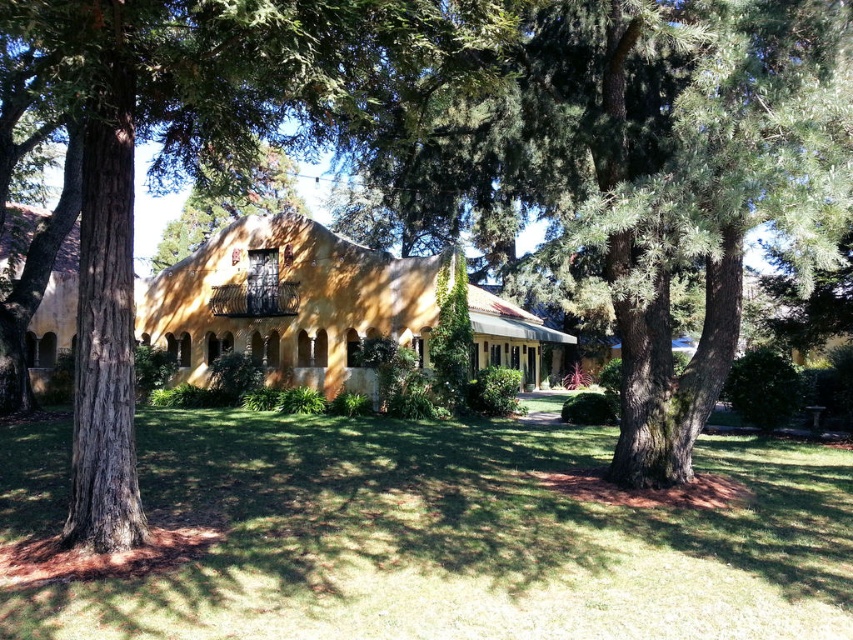
You are standing in the garden looking at the green grass at center and the green textured tree at center. Which one is closer to you?

The green grass at center is closer to you because it is in front of the green textured tree at center.

You are standing in the middle of the lawn in front of the large yellowish building. You want to walk to the point marked as point (459,538). Is this point located on the green grass at center?

Yes, the point (459,538) is on the green grass at center, so you can walk directly to it.